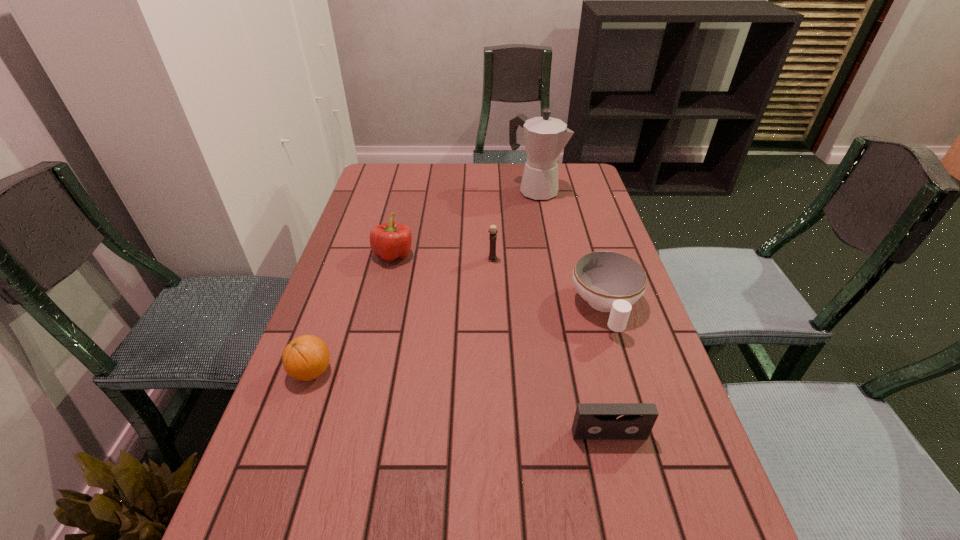
Where is `vacant space located 0.290m on the right of the bell pepper`? The width and height of the screenshot is (960, 540). vacant space located 0.290m on the right of the bell pepper is located at coordinates (515, 255).

What are the coordinates of `free space located on the side with the handle of the chinaware` in the screenshot? It's located at (637, 414).

Identify the location of free space located on the front of the leftmost object. This screenshot has width=960, height=540. (263, 509).

The width and height of the screenshot is (960, 540). In order to click on free space located 0.150m on the front-facing side of the videotape in this screenshot , I will do `click(631, 524)`.

Identify the location of object situated at the far edge. The width and height of the screenshot is (960, 540). (545, 137).

Image resolution: width=960 pixels, height=540 pixels. Find the location of `bell pepper that is at the left edge`. bell pepper that is at the left edge is located at coordinates (x=389, y=241).

This screenshot has height=540, width=960. Find the location of `orange positioned at the left edge`. orange positioned at the left edge is located at coordinates (305, 358).

Find the location of a particular element. The height and width of the screenshot is (540, 960). coffeepot that is at the right edge is located at coordinates (545, 137).

Find the location of `chinaware at the right edge`. chinaware at the right edge is located at coordinates (611, 282).

You are a GUI agent. You are given a task and a screenshot of the screen. Output one action in this format:
    pyautogui.click(x=<x>, y=<y>)
    Task: Click on the videotape situated at the right edge
    The width and height of the screenshot is (960, 540).
    Given the screenshot: What is the action you would take?
    pyautogui.click(x=593, y=421)